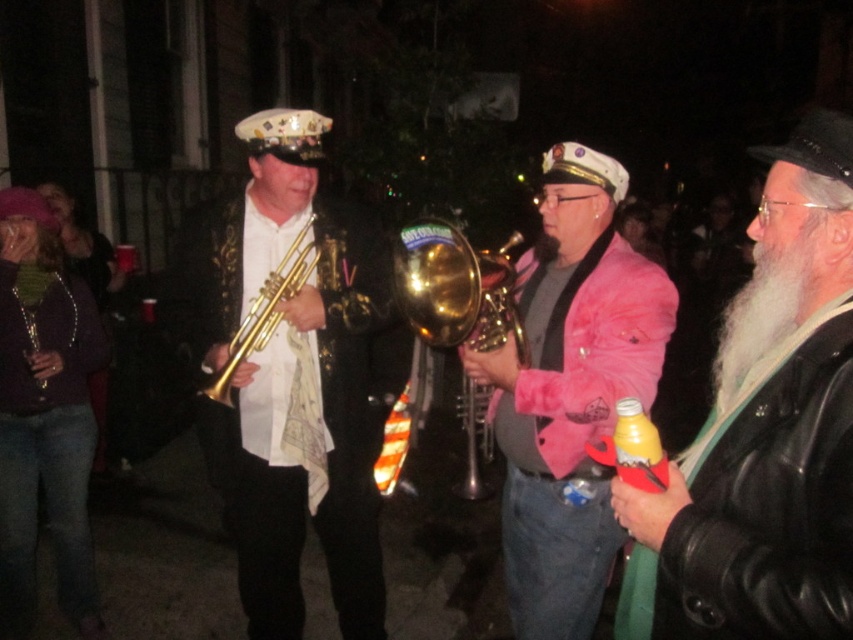
Question: Among these points, which one is nearest to the camera?

Choices:
 (A) 283,268
 (B) 305,124
 (C) 799,573

Answer: (C)

Question: Estimate the real-world distances between objects in this image. Which object is farther from the gold brass trumpet at center?

Choices:
 (A) gold shiny trumpet at left
 (B) white beard at right

Answer: (B)

Question: Which object is positioned farthest from the gold brass trumpet at center?

Choices:
 (A) gold shiny trumpet at center
 (B) white fuzzy beard at right

Answer: (B)

Question: Is white beard at right closer to camera compared to gold brass trumpet at center?

Choices:
 (A) yes
 (B) no

Answer: (A)

Question: Is white beard at right above gold brass trumpet at center?

Choices:
 (A) yes
 (B) no

Answer: (B)

Question: Is white beard at right behind gold shiny trumpet at center?

Choices:
 (A) no
 (B) yes

Answer: (A)